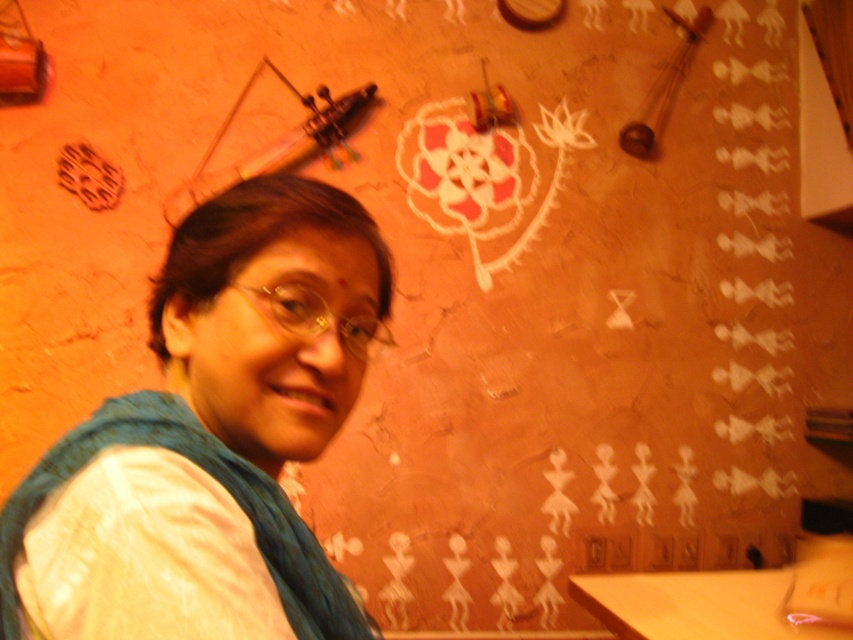
Question: Is white fabric at center above wooden table at lower right?

Choices:
 (A) yes
 (B) no

Answer: (A)

Question: Which of the following is the closest to the observer?

Choices:
 (A) white fabric at center
 (B) wooden table at lower right
 (C) blue fabric scarf at upper left

Answer: (A)

Question: Is white fabric at center to the left of blue fabric scarf at upper left from the viewer's perspective?

Choices:
 (A) yes
 (B) no

Answer: (B)

Question: Estimate the real-world distances between objects in this image. Which object is closer to the white fabric at center?

Choices:
 (A) blue fabric scarf at upper left
 (B) wooden table at lower right

Answer: (A)

Question: Which of the following is the farthest from the observer?

Choices:
 (A) (57, 557)
 (B) (715, 573)

Answer: (B)

Question: Does white fabric at center have a greater width compared to wooden table at lower right?

Choices:
 (A) yes
 (B) no

Answer: (B)